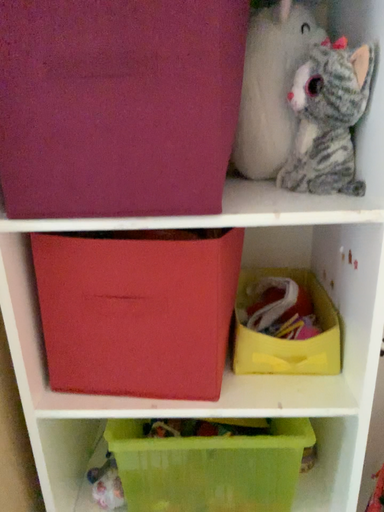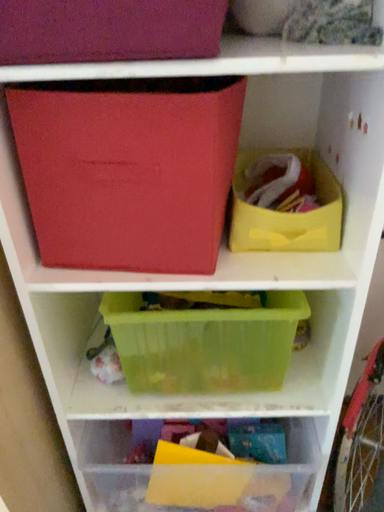
Question: Which way did the camera rotate in the video?

Choices:
 (A) rotated upward
 (B) rotated downward

Answer: (B)